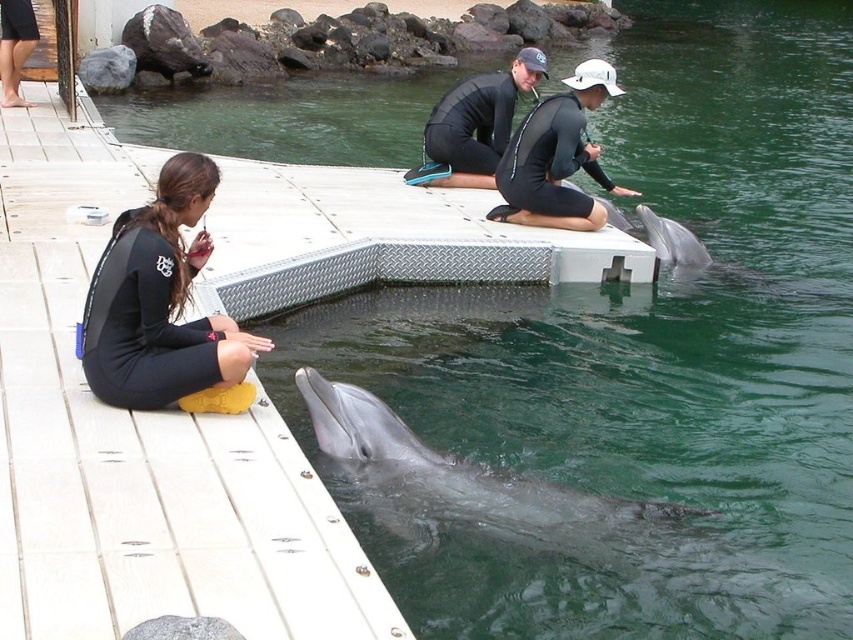
In the scene shown: You are a marine biologist observing the scene and need to determine which wetsuit is bigger between the black neoprene wetsuit at left and the black matte wetsuit at center. Based on the description, which one is larger?

The black neoprene wetsuit at left is larger than the black matte wetsuit at center according to the description.

Based on the photo, you are standing at the point marked by coordinates point (x=556, y=157). You want to move towards the woman in the black wetsuit seated on the dock. Which direction should you go?

The direction to move from point (x=556, y=157) towards the woman in the black wetsuit seated on the dock would depend on their relative positions, but since the woman is at the dock and the point is at center, moving towards the dock area would be appropriate.

You are a photographer standing on the wooden dock and want to take a photo of both the matte black wetsuit at center and the black matte wetsuit at center. Which one should you focus on first if you want to capture the one closer to the camera?

The black matte wetsuit at center is closer to the camera than the matte black wetsuit at center, so you should focus on the black matte wetsuit at center first.